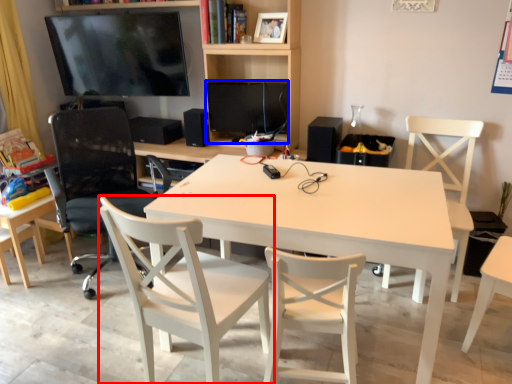
Question: Among these objects, which one is nearest to the camera, chair (highlighted by a red box) or computer monitor (highlighted by a blue box)?

Choices:
 (A) chair
 (B) computer monitor

Answer: (A)